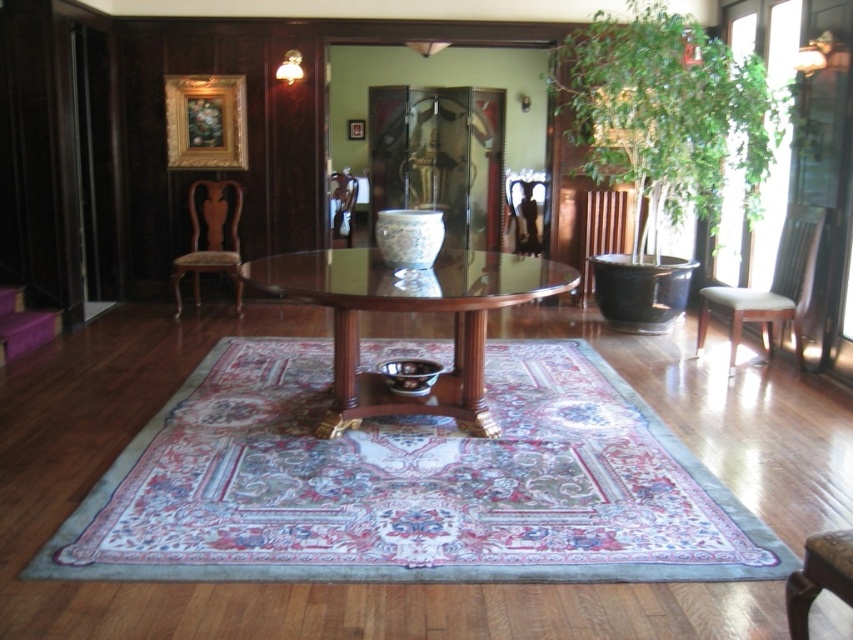
Does point (607, 209) lie behind point (350, 221)?

No, (607, 209) is closer to viewer.

Based on the photo, which is more to the right, black wood chair at right or matte brown armchair at center?

From the viewer's perspective, black wood chair at right appears more on the right side.

This screenshot has width=853, height=640. I want to click on black wood chair at right, so click(602, 230).

Where is `black wood chair at right`? This screenshot has width=853, height=640. black wood chair at right is located at coordinates (602, 230).

Can you confirm if brown leather chair at lower right is smaller than matte brown armchair at center?

Yes, brown leather chair at lower right is smaller than matte brown armchair at center.

Between brown leather chair at lower right and matte brown armchair at center, which one has less height?

brown leather chair at lower right is shorter.

Is point (848, 560) positioned behind point (334, 186)?

No.

I want to click on brown leather chair at lower right, so click(819, 577).

Based on the photo, between green leafy plant at upper right and brown wood/leather armchair at left, which one appears on the right side from the viewer's perspective?

green leafy plant at upper right is more to the right.

How far apart are green leafy plant at upper right and brown wood/leather armchair at left?

The distance of green leafy plant at upper right from brown wood/leather armchair at left is 3.02 meters.

Identify the location of green leafy plant at upper right. (666, 113).